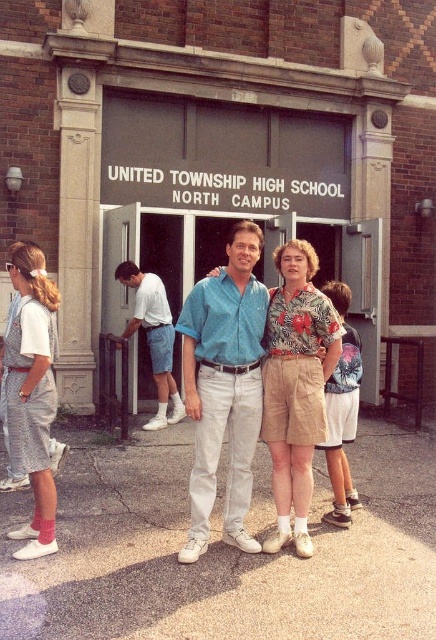
You are a photographer taking a picture of two people standing in front of United Township High School North Campus. The two people are wearing the floral print shirt at center and the floral fabric blouse at center. Which clothing item is positioned closer to the camera?

The floral print shirt at center is closer to the viewer than the floral fabric blouse at center, so the floral print shirt at center is positioned closer to the camera.

You are a photographer taking a picture of two people wearing floral clothing. The subjects are standing side by side in front of the school entrance. Which clothing item, the floral print shirt at center or the floral fabric blouse at center, will appear taller in the photo?

The floral print shirt at center will appear taller in the photo because it has a greater height compared to the floral fabric blouse at center.